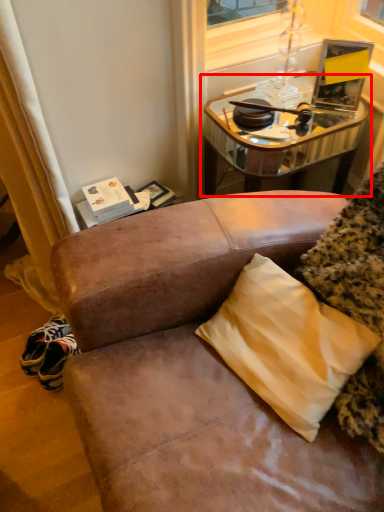
Question: From the image's perspective, where is table (annotated by the red box) located relative to pillow?

Choices:
 (A) below
 (B) above

Answer: (B)